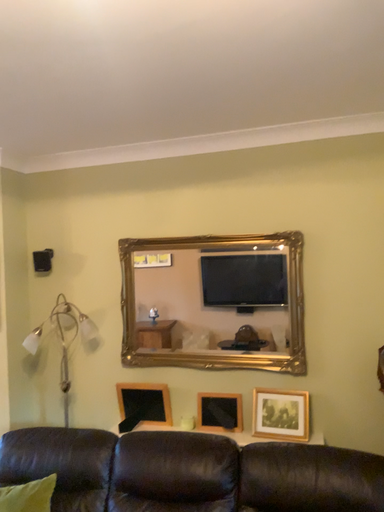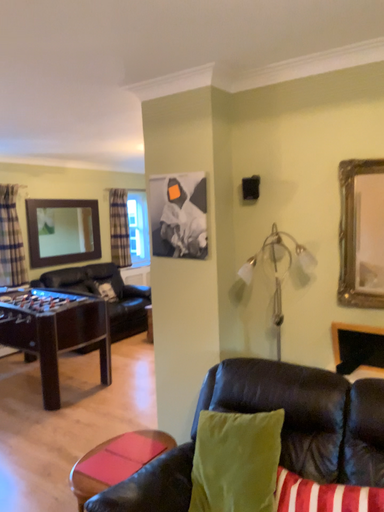
Question: How did the camera likely rotate when shooting the video?

Choices:
 (A) rotated upward
 (B) rotated downward

Answer: (B)